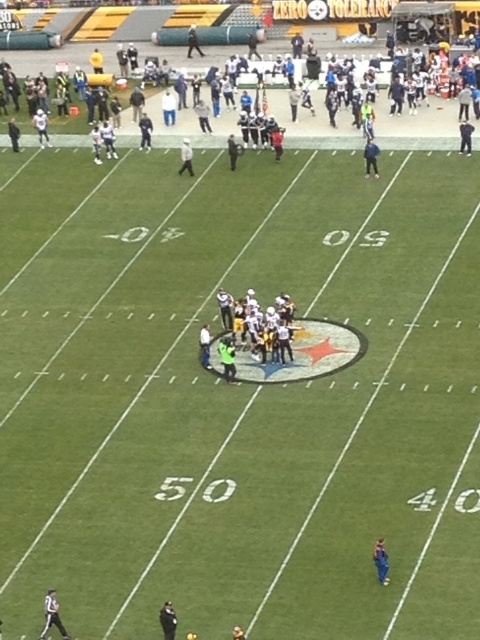
Consider the image. Between white uniformed official at lower left and white matte helmet at center, which one appears on the left side from the viewer's perspective?

white uniformed official at lower left

Who is taller, white uniformed official at lower left or white matte helmet at center?

white uniformed official at lower left is taller.

Does point (62, 637) come behind point (191, 152)?

No, (62, 637) is in front of (191, 152).

Where is `white uniformed official at lower left`? The height and width of the screenshot is (640, 480). white uniformed official at lower left is located at coordinates (51, 616).

Does dark blue uniform at center come behind golden helmet at center?

That is True.

Is dark blue uniform at center wider than golden helmet at center?

Indeed, dark blue uniform at center has a greater width compared to golden helmet at center.

Is point (149, 118) behind point (239, 632)?

Yes, point (149, 118) is behind point (239, 632).

What are the coordinates of `dark blue uniform at center` in the screenshot? It's located at (144, 131).

Which is in front, point (377, 552) or point (189, 154)?

Point (377, 552) is in front.

Measure the distance between blue fabric person at lower right and white matte helmet at center.

The distance of blue fabric person at lower right from white matte helmet at center is 29.41 meters.

What do you see at coordinates (381, 561) in the screenshot?
I see `blue fabric person at lower right` at bounding box center [381, 561].

Locate an element on the screen. The height and width of the screenshot is (640, 480). blue fabric person at lower right is located at coordinates (381, 561).